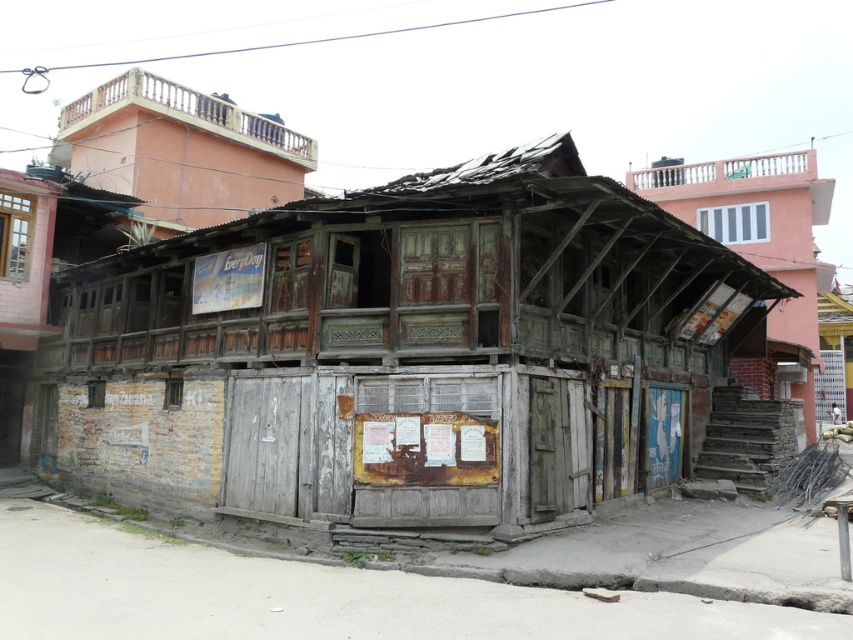
You are a surveyor tasked with assessing the structural integrity of the weathered wood hut at center. Based on the coordinates provided in the image, can you determine if the hut is positioned centrally within the frame?

Answer: The weathered wood hut at center is located at point coordinates approximately at the center of the image, so yes, it is positioned centrally within the frame.

You are a painter who needs to decide which structure to paint first. Given that the wooden balcony at upper left is narrower than the wooden shack at upper right, which one would require less time to paint based on their widths?

The wooden balcony at upper left requires less time to paint because its width is less than that of the wooden shack at upper right.

You are a delivery person trying to find the correct entrance to the weathered wood hut at center and the wooden shack at upper right. Based on their positions, which building is closer to the ground level?

The weathered wood hut at center is closer to the ground level because it is located below the wooden shack at upper right.